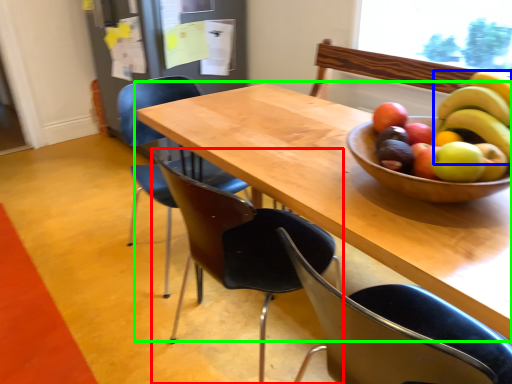
Question: Considering the real-world distances, which object is farthest from chair (highlighted by a red box)? banana (highlighted by a blue box) or table (highlighted by a green box)?

Choices:
 (A) banana
 (B) table

Answer: (A)